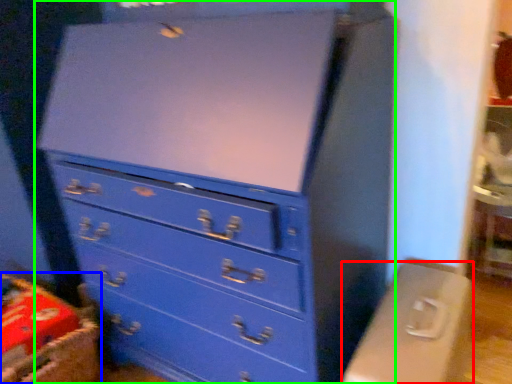
Question: Considering the real-world distances, which object is closest to computer desk (highlighted by a red box)? crate (highlighted by a blue box) or chest of drawers (highlighted by a green box).

Choices:
 (A) crate
 (B) chest of drawers

Answer: (B)